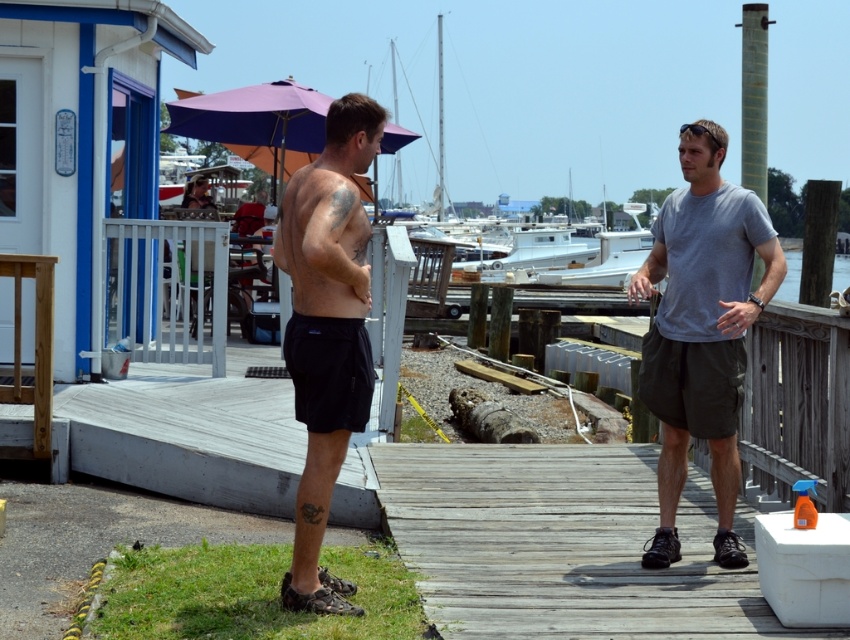
Can you confirm if white fiberglass boat at center is thinner than white glossy boat at center?

In fact, white fiberglass boat at center might be wider than white glossy boat at center.

Who is more forward, (574, 88) or (584, 284)?

Point (584, 284)

This screenshot has height=640, width=850. Find the location of `white fiberglass boat at center`. white fiberglass boat at center is located at coordinates (539, 102).

Which of these two, gray cotton t-shirt at right or clear water at dock right, stands taller?

clear water at dock right

Between point (735, 493) and point (786, 289), which one is positioned in front?

Positioned in front is point (735, 493).

Find the location of a particular element. Image resolution: width=850 pixels, height=640 pixels. gray cotton t-shirt at right is located at coordinates (701, 330).

Is white fiberglass boat at center shorter than clear water at dock right?

Incorrect, white fiberglass boat at center's height does not fall short of clear water at dock right's.

Can you confirm if white fiberglass boat at center is positioned to the left of clear water at dock right?

Indeed, white fiberglass boat at center is positioned on the left side of clear water at dock right.

Between point (624, 38) and point (790, 257), which one is positioned in front?

Point (790, 257)

I want to click on white fiberglass boat at center, so click(x=539, y=102).